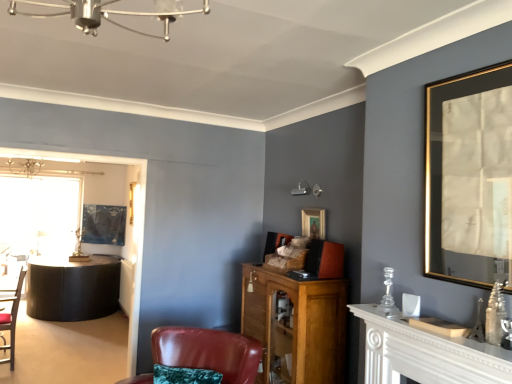
Where is `matte black chair at left, the 2th chair in the right-to-left sequence`? Image resolution: width=512 pixels, height=384 pixels. matte black chair at left, the 2th chair in the right-to-left sequence is located at coordinates (11, 318).

Find the location of a particular element. Image resolution: width=512 pixels, height=384 pixels. leather armchair at center, marked as the second chair in a left-to-right arrangement is located at coordinates (208, 351).

The height and width of the screenshot is (384, 512). Describe the element at coordinates (426, 354) in the screenshot. I see `white wooden mantelpiece at right` at that location.

At what (x,y) coordinates should I click in order to perform the action: click on matte black chair at left, acting as the 1th chair starting from the back. Please return your answer as a coordinate pair (x, y). Looking at the image, I should click on pyautogui.click(x=11, y=318).

In the scene shown: Can you confirm if matte black chair at left, placed as the 1th chair when sorted from left to right, is shorter than gold-framed mirror at upper right, acting as the 1th picture frame starting from the right?

No, matte black chair at left, placed as the 1th chair when sorted from left to right, is not shorter than gold-framed mirror at upper right, acting as the 1th picture frame starting from the right.

Is matte black chair at left, acting as the 1th chair starting from the back, turned away from gold-framed mirror at upper right, which is counted as the third picture frame, starting from the back?

No, matte black chair at left, acting as the 1th chair starting from the back, is not facing away from gold-framed mirror at upper right, which is counted as the third picture frame, starting from the back.

Is matte black chair at left, positioned as the 2th chair in front-to-back order, placed right next to gold-framed mirror at upper right, which is counted as the third picture frame, starting from the back?

They are not placed beside each other.

Is the position of matte black chair at left, positioned as the 2th chair in front-to-back order, more distant than that of gold-framed mirror at upper right, the 3th picture frame positioned from the left?

Yes, it is behind gold-framed mirror at upper right, the 3th picture frame positioned from the left.

From the image's perspective, is matte black picture frame at center, which is the 1th picture frame in back-to-front order, beneath transparent glass table at left?

No, from the image's perspective, matte black picture frame at center, which is the 1th picture frame in back-to-front order, is not below transparent glass table at left.

Considering the sizes of objects matte black picture frame at center, which is the 1th picture frame in back-to-front order, and transparent glass table at left in the image provided, who is wider, matte black picture frame at center, which is the 1th picture frame in back-to-front order, or transparent glass table at left?

With larger width is matte black picture frame at center, which is the 1th picture frame in back-to-front order.

Is matte black picture frame at center, acting as the 3th picture frame starting from the right, inside or outside of transparent glass table at left?

matte black picture frame at center, acting as the 3th picture frame starting from the right, is located beyond the bounds of transparent glass table at left.

Would you consider wooden picture frame at center, the 2th picture frame positioned from the front, to be distant from wooden cabinet at center?

They are positioned close to each other.

Which is in front, point (314, 213) or point (275, 316)?

The point (275, 316) is closer to the camera.

Does wooden picture frame at center, acting as the second picture frame starting from the back, come behind wooden cabinet at center?

Yes, wooden picture frame at center, acting as the second picture frame starting from the back, is further from the camera.

Based on their positions, is wooden picture frame at center, acting as the second picture frame starting from the back, located to the left or right of wooden cabinet at center?

Based on their positions, wooden picture frame at center, acting as the second picture frame starting from the back, is located to the right of wooden cabinet at center.

Which of these two, leather armchair at center, marked as the second chair in a left-to-right arrangement, or wooden picture frame at center, marked as the second picture frame in a right-to-left arrangement, is bigger?

leather armchair at center, marked as the second chair in a left-to-right arrangement.

Is leather armchair at center, marked as the second chair in a left-to-right arrangement, oriented towards wooden picture frame at center, the 2th picture frame positioned from the front?

No, leather armchair at center, marked as the second chair in a left-to-right arrangement, is not aimed at wooden picture frame at center, the 2th picture frame positioned from the front.

Which object is more forward, leather armchair at center, the first chair in the front-to-back sequence, or wooden picture frame at center, which ranks as the second picture frame in left-to-right order?

leather armchair at center, the first chair in the front-to-back sequence, is closer to the camera.

Is leather armchair at center, the first chair from the right, positioned beyond the bounds of wooden picture frame at center, the 2th picture frame positioned from the front?

Yes, leather armchair at center, the first chair from the right, is not within wooden picture frame at center, the 2th picture frame positioned from the front.

Is point (325, 341) behind point (6, 316)?

No.

From their relative heights in the image, would you say wooden cabinet at center is taller or shorter than matte black chair at left, placed as the 1th chair when sorted from left to right?

Considering their sizes, wooden cabinet at center has more height than matte black chair at left, placed as the 1th chair when sorted from left to right.

Is wooden cabinet at center not within matte black chair at left, placed as the 1th chair when sorted from left to right?

Yes.

Is gold-framed mirror at upper right, placed as the 1th picture frame when sorted from front to back, facing towards matte black chair at left, placed as the 1th chair when sorted from left to right?

No, gold-framed mirror at upper right, placed as the 1th picture frame when sorted from front to back, is not facing towards matte black chair at left, placed as the 1th chair when sorted from left to right.

In terms of height, does gold-framed mirror at upper right, which is counted as the third picture frame, starting from the back, look taller or shorter compared to matte black chair at left, the 2th chair in the right-to-left sequence?

gold-framed mirror at upper right, which is counted as the third picture frame, starting from the back, is shorter than matte black chair at left, the 2th chair in the right-to-left sequence.

Identify the location of the 3rd picture frame above the matte black chair at left, the 2th chair in the right-to-left sequence (from the image's perspective). The image size is (512, 384). (469, 178).

Visually, is gold-framed mirror at upper right, placed as the 1th picture frame when sorted from front to back, positioned to the left or to the right of matte black chair at left, placed as the 1th chair when sorted from left to right?

Clearly, gold-framed mirror at upper right, placed as the 1th picture frame when sorted from front to back, is on the right of matte black chair at left, placed as the 1th chair when sorted from left to right, in the image.

The height and width of the screenshot is (384, 512). Find the location of `the 2nd chair counting from the right side of the transparent glass table at left`. the 2nd chair counting from the right side of the transparent glass table at left is located at coordinates 208,351.

Considering the sizes of leather armchair at center, which is counted as the second chair, starting from the back, and transparent glass table at left in the image, is leather armchair at center, which is counted as the second chair, starting from the back, taller or shorter than transparent glass table at left?

In the image, leather armchair at center, which is counted as the second chair, starting from the back, appears to be shorter than transparent glass table at left.

Which is in front, point (213, 351) or point (10, 221)?

The point (213, 351) is closer to the camera.

From the picture: Considering the relative sizes of leather armchair at center, marked as the second chair in a left-to-right arrangement, and transparent glass table at left in the image provided, is leather armchair at center, marked as the second chair in a left-to-right arrangement, wider than transparent glass table at left?

Yes.

This screenshot has width=512, height=384. There is a matte black chair at left, the 2th chair in the right-to-left sequence. Identify the location of the 3rd picture frame above it (from a real-world perspective). (469, 178).

The height and width of the screenshot is (384, 512). In order to click on window screen behind the matte black picture frame at center, marked as the 3th picture frame in a front-to-back arrangement in this screenshot , I will do `click(39, 216)`.

Estimate the real-world distances between objects in this image. Which object is closer to gold-framed mirror at upper right, acting as the 1th picture frame starting from the right, white wooden mantelpiece at right or wooden cabinet at center?

Based on the image, white wooden mantelpiece at right appears to be nearer to gold-framed mirror at upper right, acting as the 1th picture frame starting from the right.

Based on their spatial positions, is transparent glass table at left or white wooden mantelpiece at right further from gold-framed mirror at upper right, placed as the 1th picture frame when sorted from front to back?

transparent glass table at left is positioned further to the anchor gold-framed mirror at upper right, placed as the 1th picture frame when sorted from front to back.

Estimate the real-world distances between objects in this image. Which object is closer to matte black picture frame at center, marked as the 3th picture frame in a front-to-back arrangement, wooden cabinet at center or wooden picture frame at center, marked as the second picture frame in a right-to-left arrangement?

wooden picture frame at center, marked as the second picture frame in a right-to-left arrangement, lies closer to matte black picture frame at center, marked as the 3th picture frame in a front-to-back arrangement, than the other object.

Looking at the image, which one is located further to white wooden mantelpiece at right, leather armchair at center, which is counted as the second chair, starting from the back, or wooden picture frame at center, marked as the second picture frame in a right-to-left arrangement?

The object further to white wooden mantelpiece at right is wooden picture frame at center, marked as the second picture frame in a right-to-left arrangement.

Estimate the real-world distances between objects in this image. Which object is closer to matte black chair at left, positioned as the 2th chair in front-to-back order, wooden picture frame at center, the 2th picture frame positioned from the front, or transparent glass table at left?

transparent glass table at left is closer to matte black chair at left, positioned as the 2th chair in front-to-back order.

Which object lies nearer to the anchor point transparent glass table at left, leather armchair at center, marked as the second chair in a left-to-right arrangement, or gold-framed mirror at upper right, placed as the 1th picture frame when sorted from front to back?

leather armchair at center, marked as the second chair in a left-to-right arrangement.

From the image, which object appears to be nearer to leather armchair at center, the first chair in the front-to-back sequence, matte black picture frame at center, which is the 1th picture frame in back-to-front order, or matte black chair at left, the 2th chair in the right-to-left sequence?

matte black chair at left, the 2th chair in the right-to-left sequence.

Which object lies nearer to the anchor point wooden cabinet at center, transparent glass table at left or matte black chair at left, acting as the 1th chair starting from the back?

The object closer to wooden cabinet at center is matte black chair at left, acting as the 1th chair starting from the back.

This screenshot has height=384, width=512. I want to click on cabinetry between gold-framed mirror at upper right, acting as the 1th picture frame starting from the right, and matte black picture frame at center, which is the 1th picture frame in back-to-front order, from front to back, so click(x=296, y=325).

At what (x,y) coordinates should I click in order to perform the action: click on picture frame between matte black chair at left, positioned as the 2th chair in front-to-back order, and gold-framed mirror at upper right, the 3th picture frame positioned from the left, in the horizontal direction. Please return your answer as a coordinate pair (x, y). The height and width of the screenshot is (384, 512). Looking at the image, I should click on (313, 223).

Where is `picture frame between white wooden mantelpiece at right and wooden cabinet at center from front to back`? The image size is (512, 384). picture frame between white wooden mantelpiece at right and wooden cabinet at center from front to back is located at coordinates (469, 178).

Locate an element on the screen. This screenshot has width=512, height=384. table between leather armchair at center, the first chair from the right, and gold-framed mirror at upper right, acting as the 1th picture frame starting from the right, in the horizontal direction is located at coordinates (426, 354).